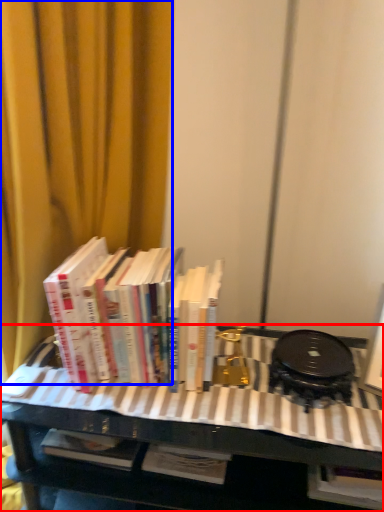
Question: Which of the following is the closest to the observer, table (highlighted by a red box) or curtain (highlighted by a blue box)?

Choices:
 (A) table
 (B) curtain

Answer: (B)